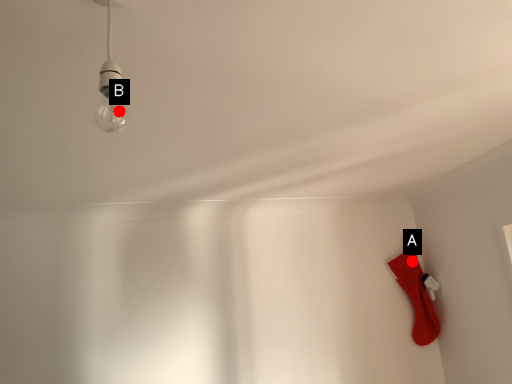
Question: Two points are circled on the image, labeled by A and B beside each circle. Which point is farther from the camera taking this photo?

Choices:
 (A) A is further
 (B) B is further

Answer: (A)